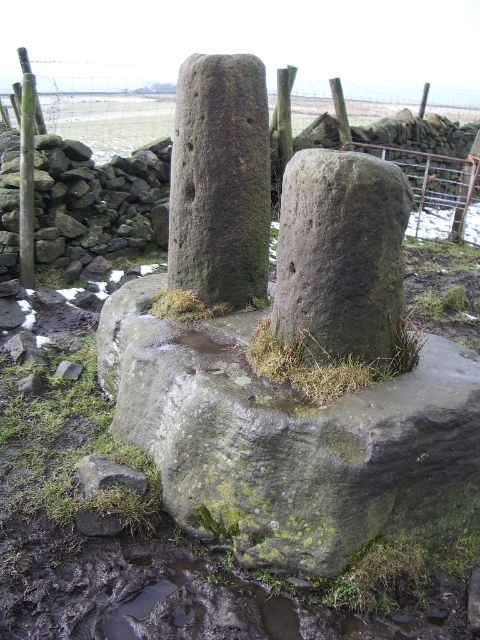
You are a hiker trying to navigate through the snowy terrain. You see the smooth wooden post at left and the green mossy rock at lower left. Which object is located more to the left side of your view?

The smooth wooden post at left is positioned on the left side of green mossy rock at lower left, so the smooth wooden post at left is more to the left.

You are a hiker trying to navigate through a snowy field. You see the green mossy stone at center and the green mossy rock at lower left. Which one is higher up in the scene?

The green mossy stone at center is above the green mossy rock at lower left, so it is higher up in the scene.